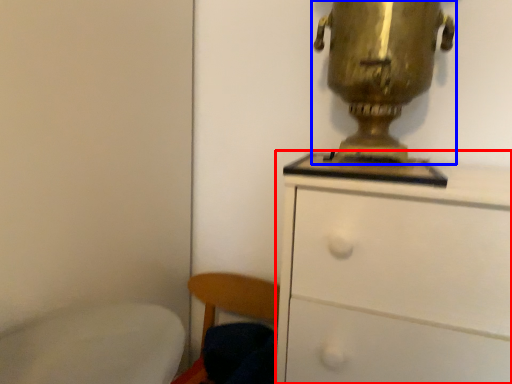
Question: Which of the following is the closest to the observer, chest of drawers (highlighted by a red box) or table lamp (highlighted by a blue box)?

Choices:
 (A) chest of drawers
 (B) table lamp

Answer: (A)